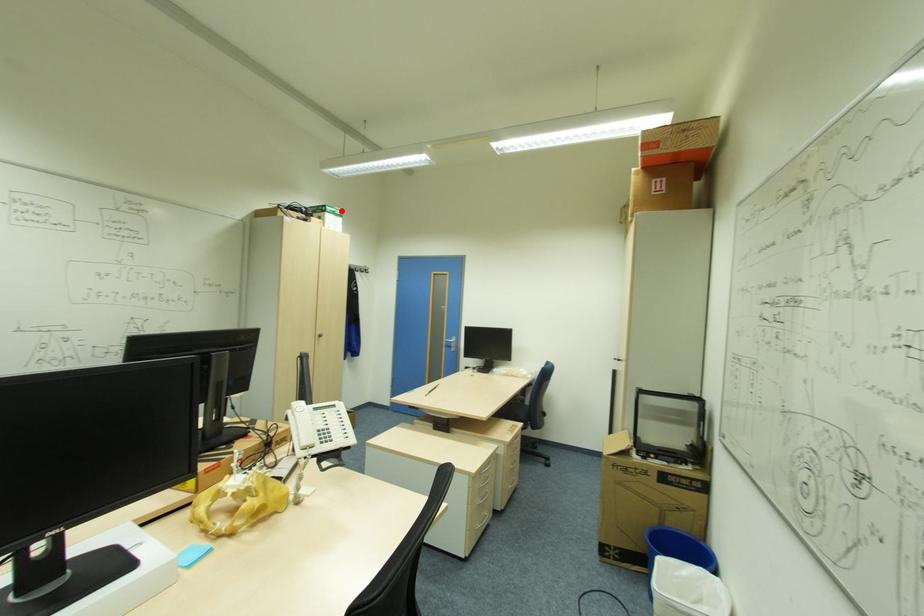
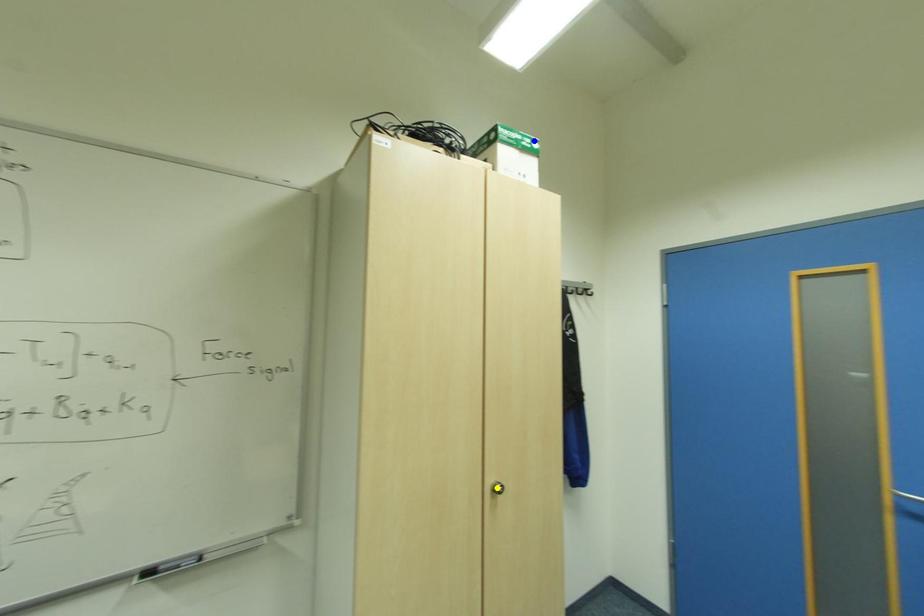
Question: I am providing you with two images of the same scene from different viewpoints. A red point is marked on the first image. You are given multiple points on the second image. In image 2, which mark is for the same physical point as the one in image 1?

Choices:
 (A) blue point
 (B) green point
 (C) yellow point

Answer: (A)